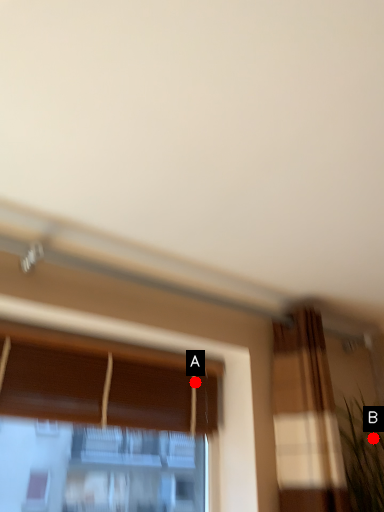
Question: Two points are circled on the image, labeled by A and B beside each circle. Which point is farther from the camera taking this photo?

Choices:
 (A) A is further
 (B) B is further

Answer: (B)